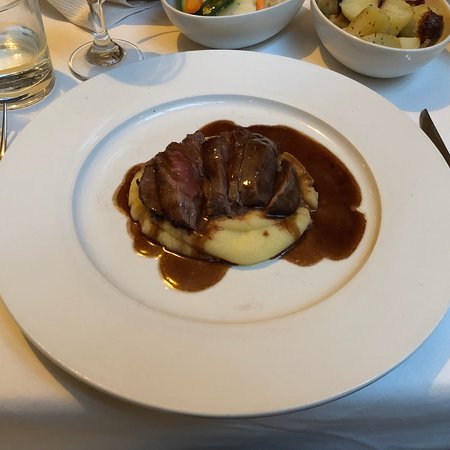
This screenshot has height=450, width=450. What are the coordinates of `bowl` in the screenshot? It's located at (379, 38).